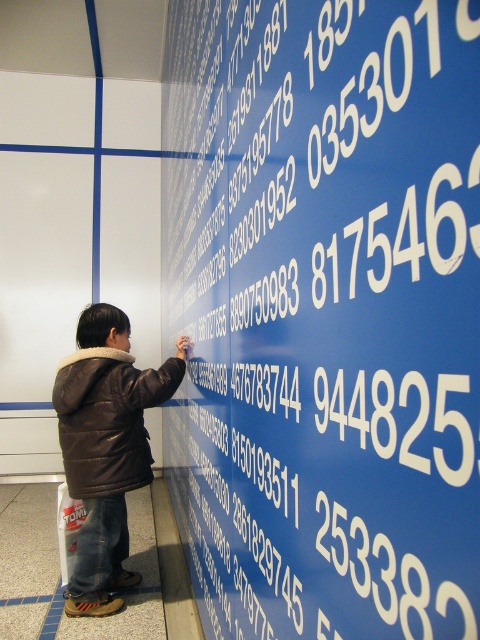
You are standing in front of the large blue wall with white numbers. You see two points marked on the wall at coordinates point [445,132] and point [98,374]. Which point is closer to you?

Point [445,132] is closer to the camera than point [98,374], so the point closer to you is point [445,132].